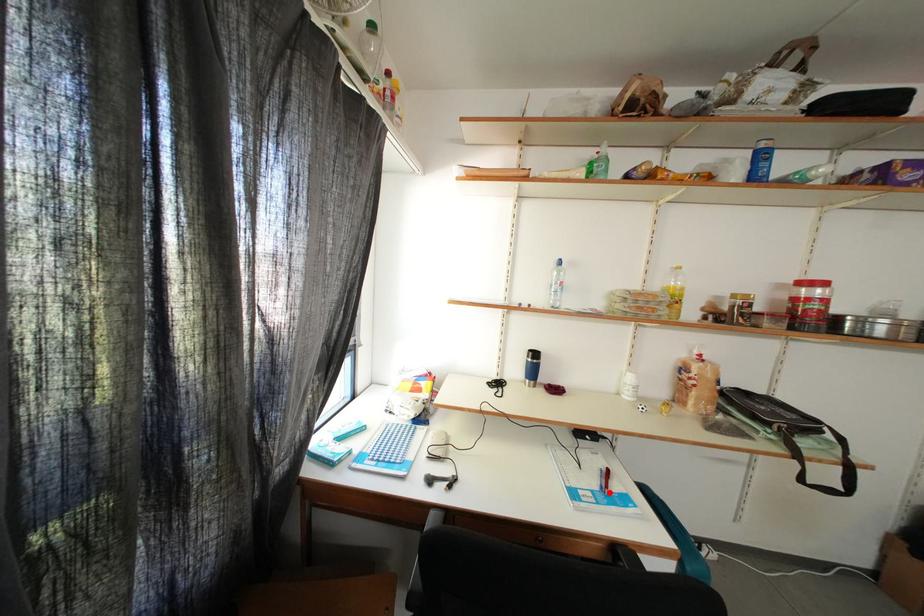
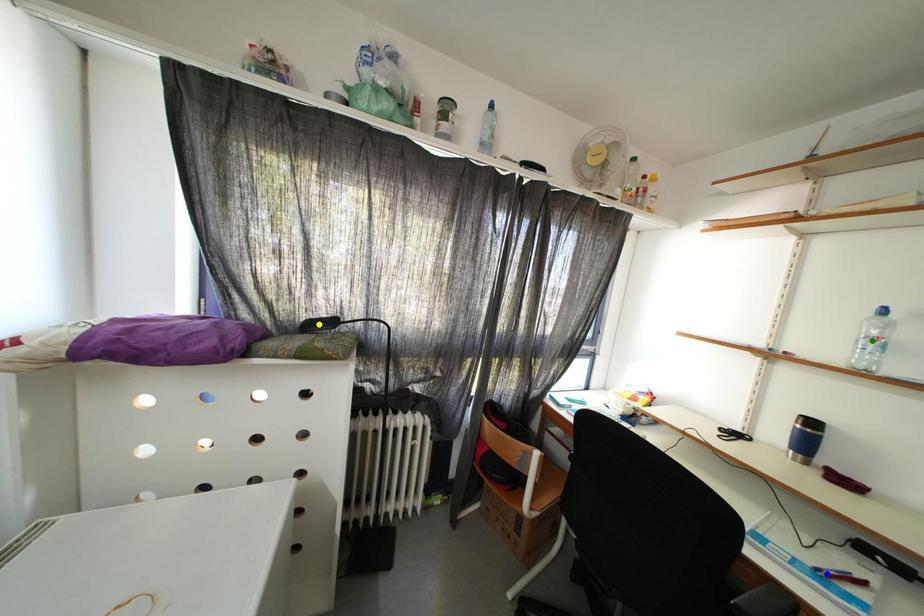
Question: I am providing you with two images of the same scene from different viewpoints. A red point is marked on the first image. You are given multiple points on the second image. Can you choose the point in image 2 that corresponds to the point in image 1?

Choices:
 (A) green point
 (B) blue point
 (C) yellow point

Answer: (B)